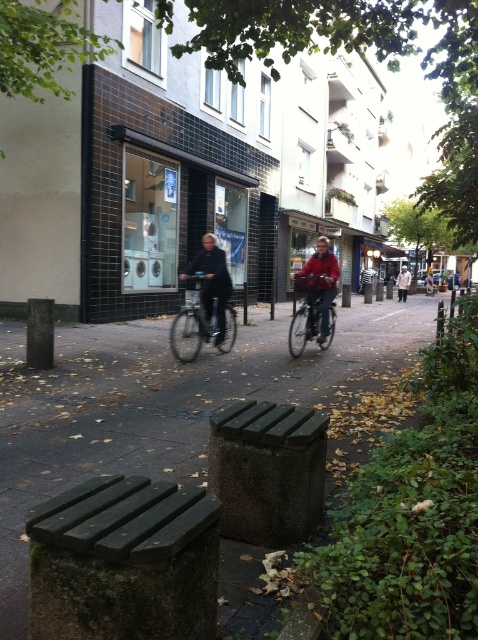
Question: Can you confirm if green mossy bench at lower left is thinner than light beige coat at center?

Choices:
 (A) yes
 (B) no

Answer: (B)

Question: Which point is farther to the camera?

Choices:
 (A) dark green wooden bench at lower center
 (B) metallic silver bicycle at center
 (C) red matte jacket at center
 (D) matte black bicycle at center

Answer: (B)

Question: Is green mossy bench at lower left to the left of matte black bicycle at center from the viewer's perspective?

Choices:
 (A) yes
 (B) no

Answer: (A)

Question: Among these points, which one is farthest from the camera?

Choices:
 (A) (39, 454)
 (B) (330, 269)
 (C) (401, 276)
 (D) (219, 298)

Answer: (C)

Question: Which point is closer to the camera taking this photo?

Choices:
 (A) (220, 301)
 (B) (119, 634)

Answer: (B)

Question: Does green mossy bench at lower left appear under light beige coat at center?

Choices:
 (A) no
 (B) yes

Answer: (B)